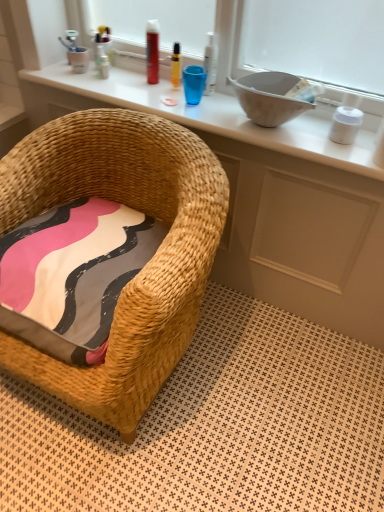
In order to click on free spot to the left of translucent yellow bottle at upper center, the third toiletry viewed from the left in this screenshot , I will do `click(129, 89)`.